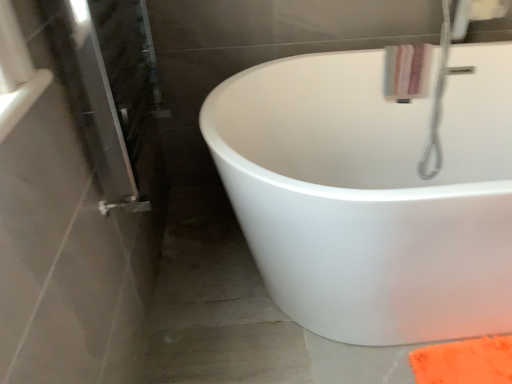
Question: Is white glossy bathtub at center wider than striped cotton bath towel at upper right?

Choices:
 (A) no
 (B) yes

Answer: (B)

Question: Does white glossy bathtub at center have a greater height compared to striped cotton bath towel at upper right?

Choices:
 (A) no
 (B) yes

Answer: (B)

Question: Considering the relative sizes of white glossy bathtub at center and striped cotton bath towel at upper right in the image provided, is white glossy bathtub at center smaller than striped cotton bath towel at upper right?

Choices:
 (A) yes
 (B) no

Answer: (B)

Question: Is white glossy bathtub at center beside striped cotton bath towel at upper right?

Choices:
 (A) no
 (B) yes

Answer: (A)

Question: Can you confirm if white glossy bathtub at center is bigger than striped cotton bath towel at upper right?

Choices:
 (A) yes
 (B) no

Answer: (A)

Question: Would you say white glossy bathtub at center is a long distance from striped cotton bath towel at upper right?

Choices:
 (A) yes
 (B) no

Answer: (B)

Question: Considering the relative sizes of striped cotton bath towel at upper right and white glossy bathtub at center in the image provided, is striped cotton bath towel at upper right wider than white glossy bathtub at center?

Choices:
 (A) yes
 (B) no

Answer: (B)

Question: From a real-world perspective, is striped cotton bath towel at upper right located beneath white glossy bathtub at center?

Choices:
 (A) yes
 (B) no

Answer: (B)

Question: Is striped cotton bath towel at upper right bigger than white glossy bathtub at center?

Choices:
 (A) no
 (B) yes

Answer: (A)

Question: Considering the relative positions of striped cotton bath towel at upper right and white glossy bathtub at center in the image provided, is striped cotton bath towel at upper right to the right of white glossy bathtub at center from the viewer's perspective?

Choices:
 (A) yes
 (B) no

Answer: (A)

Question: Does striped cotton bath towel at upper right have a smaller size compared to white glossy bathtub at center?

Choices:
 (A) no
 (B) yes

Answer: (B)

Question: Is striped cotton bath towel at upper right aimed at white glossy bathtub at center?

Choices:
 (A) yes
 (B) no

Answer: (A)

Question: Is white glossy bathtub at center inside or outside of striped cotton bath towel at upper right?

Choices:
 (A) inside
 (B) outside

Answer: (B)